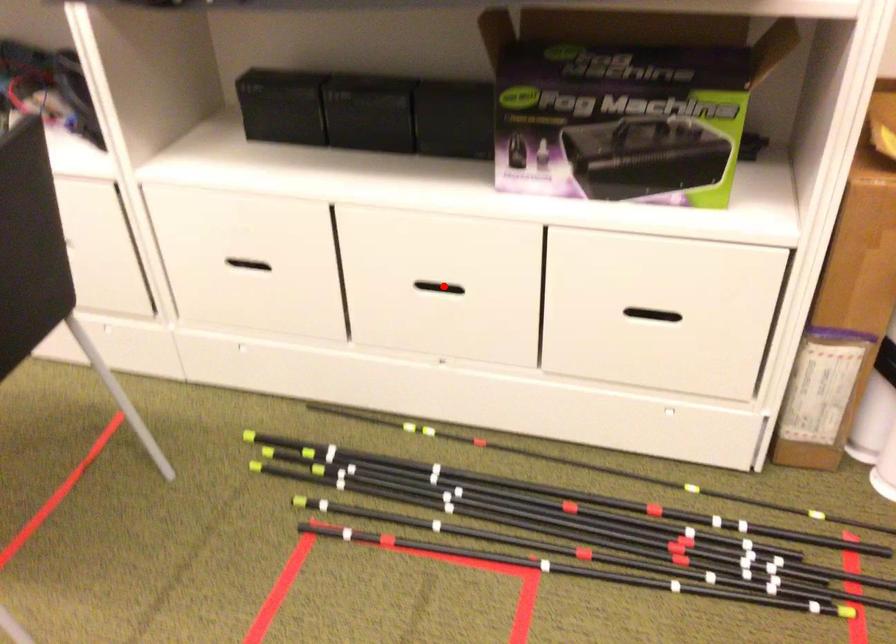
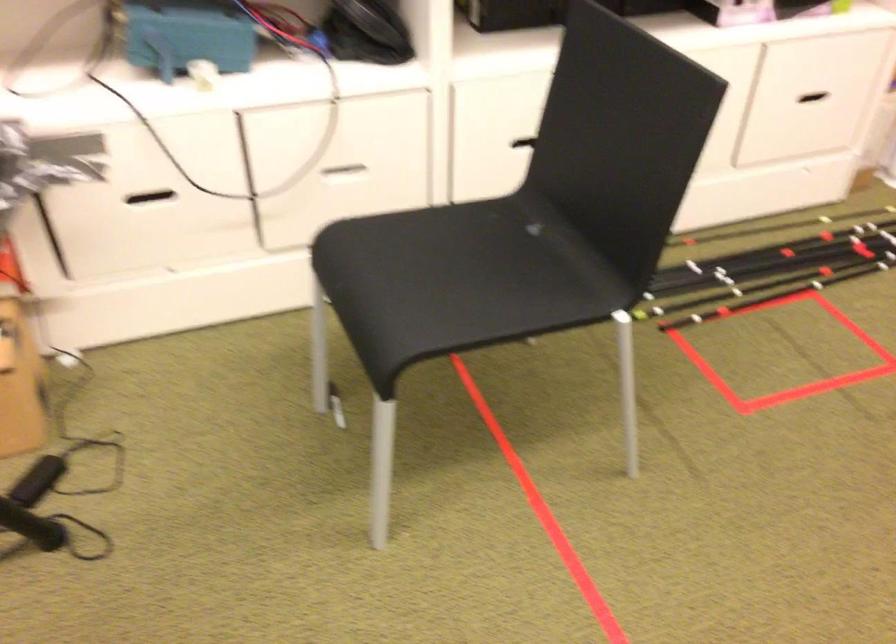
Question: I am providing you with two images of the same scene from different viewpoints. A red point is marked on the first image. At the location where the point appears in image 1, is it still visible in image 2?

Choices:
 (A) Yes
 (B) No

Answer: (B)